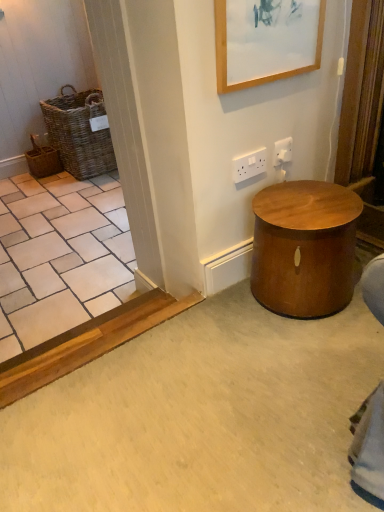
You are a GUI agent. You are given a task and a screenshot of the screen. Output one action in this format:
    pyautogui.click(x=<x>, y=<y>)
    Task: Click on the free spot to the left of shiny brown stool at lower right
    This screenshot has height=512, width=384.
    Given the screenshot: What is the action you would take?
    pyautogui.click(x=215, y=321)